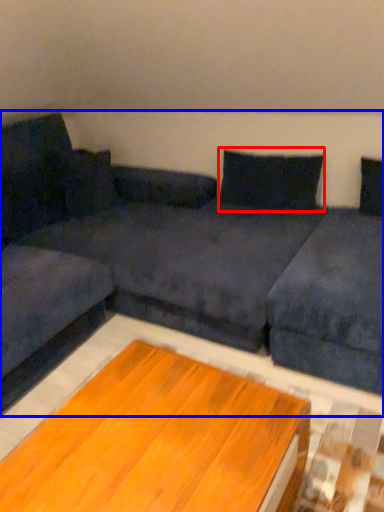
Question: Which object appears farthest to the camera in this image, pillow (highlighted by a red box) or studio couch (highlighted by a blue box)?

Choices:
 (A) pillow
 (B) studio couch

Answer: (A)